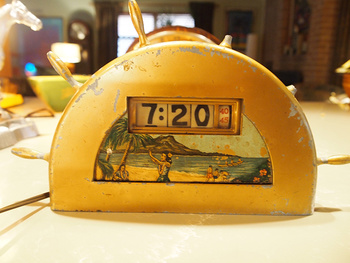
Find the location of a particular element. ceramic white horse statue/ornament is located at coordinates (14, 12).